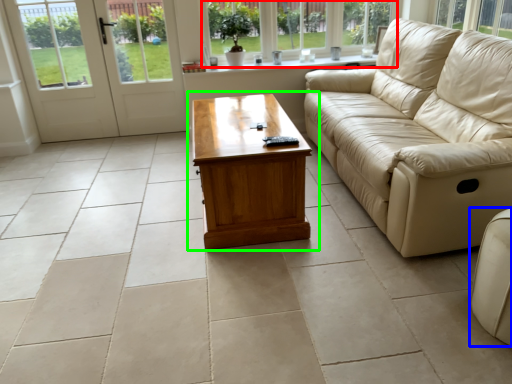
Question: Which object is positioned farthest from window (highlighted by a red box)? Select from studio couch (highlighted by a blue box) and coffee table (highlighted by a green box).

Choices:
 (A) studio couch
 (B) coffee table

Answer: (A)